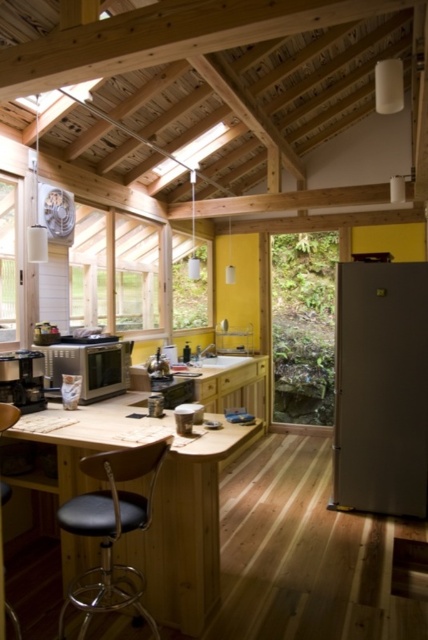
Measure the distance between satin silver refrigerator at right and camera.

satin silver refrigerator at right is 3.35 meters away from camera.

This screenshot has width=428, height=640. Describe the element at coordinates (380, 388) in the screenshot. I see `satin silver refrigerator at right` at that location.

Describe the element at coordinates (380, 388) in the screenshot. Image resolution: width=428 pixels, height=640 pixels. I see `satin silver refrigerator at right` at that location.

The width and height of the screenshot is (428, 640). I want to click on satin silver refrigerator at right, so click(380, 388).

Can you confirm if wooden at upper center is shorter than black leather bar stool at center?

No, wooden at upper center is not shorter than black leather bar stool at center.

Where is `wooden at upper center`? This screenshot has width=428, height=640. wooden at upper center is located at coordinates (204, 80).

Is point (246, 6) positioned behind point (359, 378)?

No, (246, 6) is in front of (359, 378).

Between point (125, 182) and point (347, 314), which one is positioned in front?

Point (347, 314) is more forward.

Which is behind, point (109, 48) or point (410, 292)?

The point (410, 292) is more distant.

This screenshot has width=428, height=640. Find the location of `wooden at upper center`. wooden at upper center is located at coordinates coord(204,80).